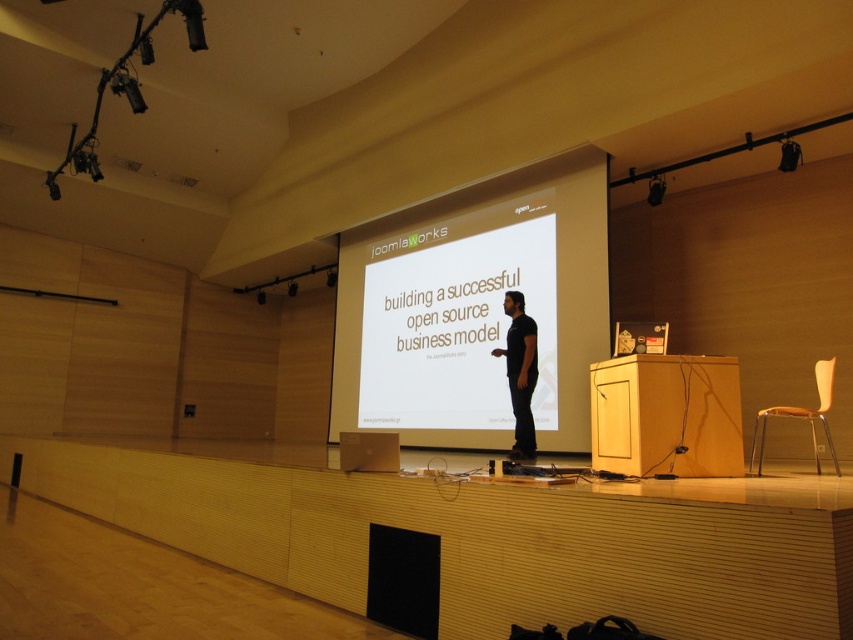
You are an event organizer who needs to set up a new projector. The projector you have is 1.2 meters tall. The distance between the projector and the white matte projection screen at center must be at least 5 meters for optimal viewing. Can you place the projector at the back of the stage and still meet the required distance?

The distance between the projector and the white matte projection screen at center is 6.72 meters, which is more than the required 5 meters. Therefore, placing the projector at the back of the stage will meet the distance requirement.

You are an event organizer who needs to place a new banner between the white matte projection screen at center and the dark brown leather jacket at center. Which object should the banner be placed closer to if the banner needs to be seen clearly by the audience?

The banner should be placed closer to the white matte projection screen at center because it has a larger size compared to the dark brown leather jacket at center, making it a better reference point for visibility.